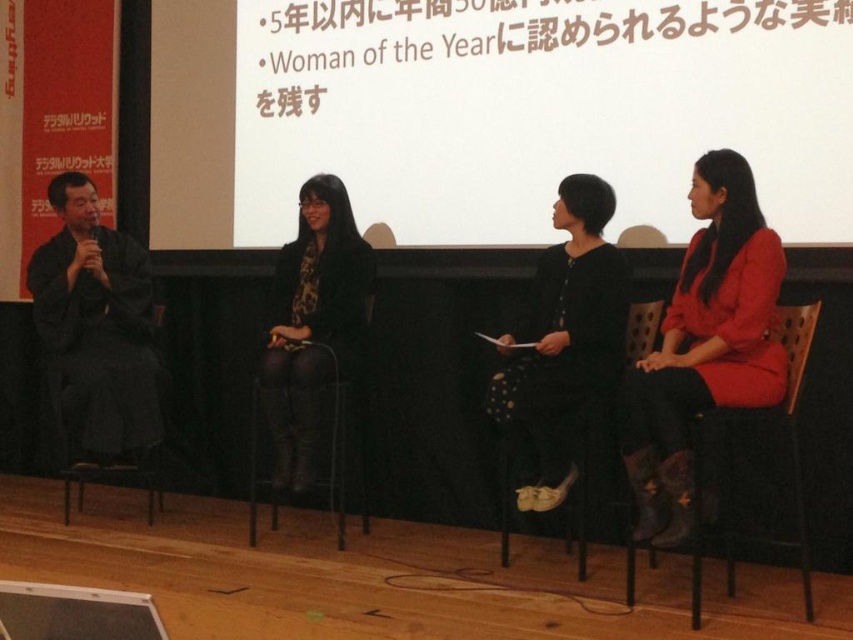
You are an event organizer setting up a camera to capture the panel discussion. The camera is placed at the front of the stage and needs to focus on the brown wooden chair at right. According to the coordinates given, where should the camera be positioned relative to the stage?

The brown wooden chair at right is located at coordinates point (737,470), so the camera should be positioned to focus on that point to capture the chair effectively.

You are an event organizer who needs to place a 1.5 meter long table between the brown wooden chair at right and the black metal chair at center. Will the table fit in the space between them?

The distance between the brown wooden chair at right and the black metal chair at center is 1.88 meters, so a 1.5 meter long table can fit in the space between them since it is shorter than the available distance.

You are an event organizer who needs to arrange a photo shoot for the panelists. The photographer wants to ensure the matte red dress at right and the black fabric chair at center are both visible in the frame. Based on their positions, which object should be placed closer to the camera to keep both in focus?

The matte red dress at right is positioned on the right side of black fabric chair at center. To keep both in focus, the black fabric chair at center should be placed closer to the camera since it is positioned to the left of the matte red dress at right, making it closer to the camera by default.